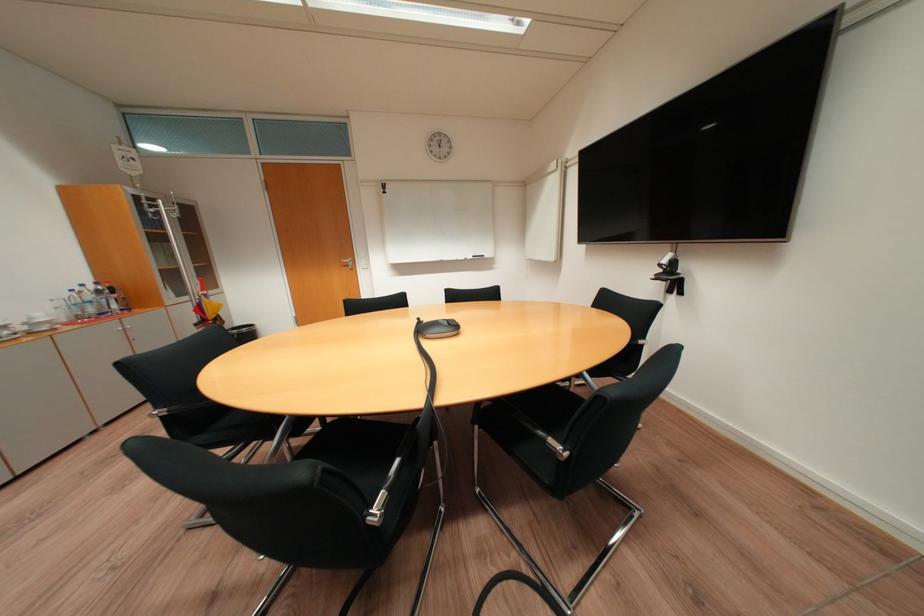
Identify the location of black webcam. This screenshot has height=616, width=924. (669, 262).